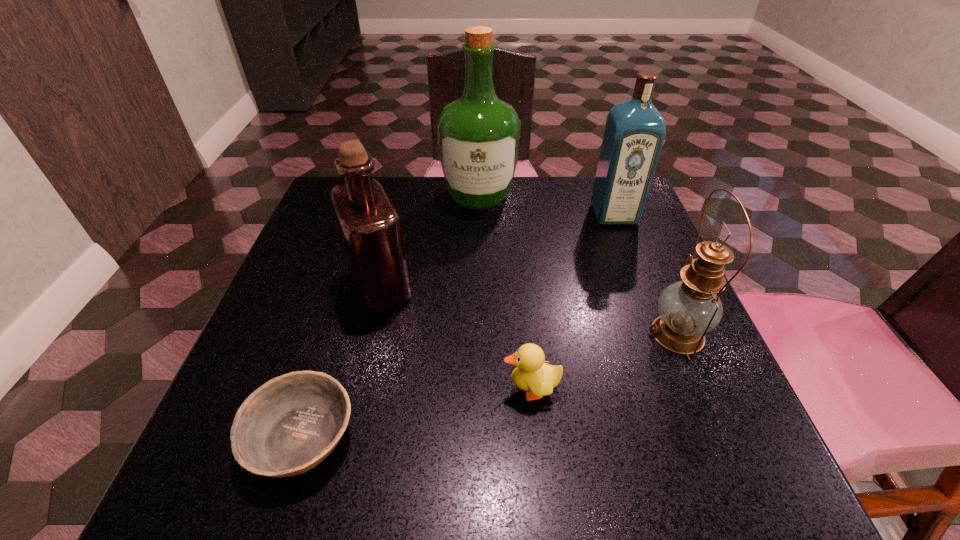
You are a GUI agent. You are given a task and a screenshot of the screen. Output one action in this format:
    pyautogui.click(x=<x>, y=<y>)
    Task: Click on the object present at the near left corner
    The width and height of the screenshot is (960, 540).
    Given the screenshot: What is the action you would take?
    pyautogui.click(x=286, y=427)

You are a GUI agent. You are given a task and a screenshot of the screen. Output one action in this format:
    pyautogui.click(x=<x>, y=<y>)
    Task: Click on the object that is at the far right corner
    
    Given the screenshot: What is the action you would take?
    pyautogui.click(x=635, y=130)

Locate an element on the screen. The image size is (960, 540). vacant space at the far edge is located at coordinates (484, 226).

Locate an element on the screen. The height and width of the screenshot is (540, 960). free space at the left edge of the desktop is located at coordinates (300, 362).

Where is `blank area at the right edge`? This screenshot has height=540, width=960. blank area at the right edge is located at coordinates (698, 435).

Where is `vacant space at the far left corner of the desktop`? vacant space at the far left corner of the desktop is located at coordinates (390, 180).

Where is `free location at the near right corner`? This screenshot has width=960, height=540. free location at the near right corner is located at coordinates click(x=755, y=446).

The image size is (960, 540). What are the coordinates of `free space between the tallest liquor and the rightmost liquor` in the screenshot? It's located at (546, 206).

You are a GUI agent. You are given a task and a screenshot of the screen. Output one action in this format:
    pyautogui.click(x=<x>, y=<y>)
    Task: Click on the vacant area between the fifth tallest object and the bowl
    This screenshot has height=540, width=960.
    Given the screenshot: What is the action you would take?
    pyautogui.click(x=417, y=413)

At what (x,y) coordinates should I click in order to perform the action: click on unoccupied position between the bowl and the rightmost liquor. Please return your answer as a coordinate pair (x, y). The width and height of the screenshot is (960, 540). Looking at the image, I should click on (458, 326).